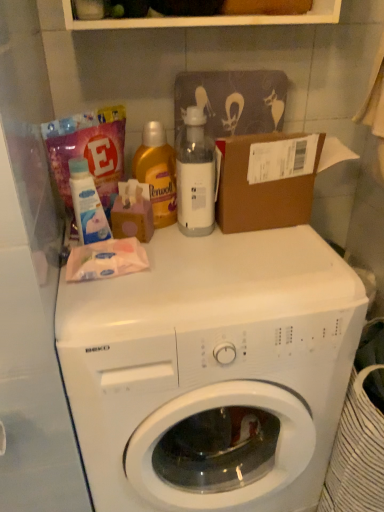
Locate an element on the screen. vacant area that is in front of white glossy lotion at upper left, the second cleaning product when ordered from right to left is located at coordinates (104, 294).